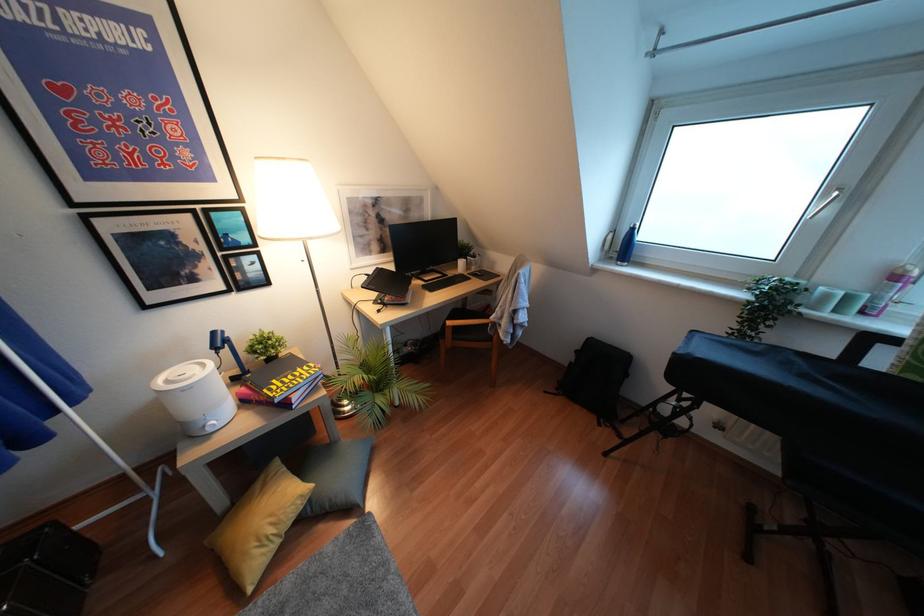
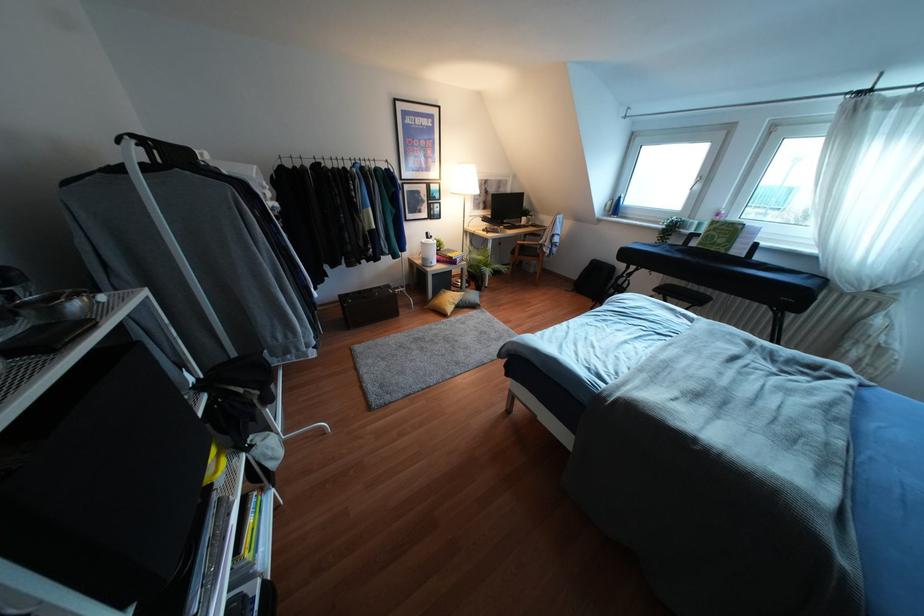
Locate, in the second image, the point that corresponds to pixel 213 333 in the first image.

(427, 233)